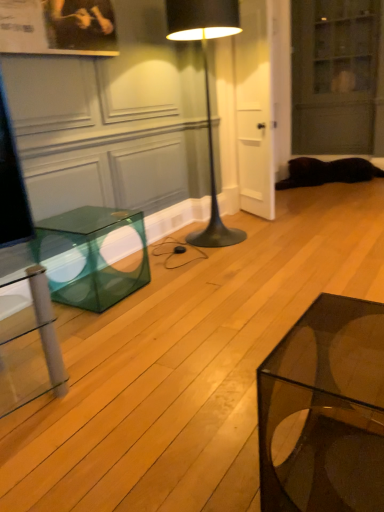
Question: Considering the relative sizes of black metal floor lamp at center and transparent glass cabinet at upper right in the image provided, is black metal floor lamp at center taller than transparent glass cabinet at upper right?

Choices:
 (A) yes
 (B) no

Answer: (B)

Question: Is black metal floor lamp at center positioned with its back to transparent glass cabinet at upper right?

Choices:
 (A) yes
 (B) no

Answer: (B)

Question: Is the position of black metal floor lamp at center more distant than that of transparent glass cabinet at upper right?

Choices:
 (A) no
 (B) yes

Answer: (A)

Question: Considering the relative sizes of black metal floor lamp at center and transparent glass cabinet at upper right in the image provided, is black metal floor lamp at center smaller than transparent glass cabinet at upper right?

Choices:
 (A) yes
 (B) no

Answer: (A)

Question: Considering the relative sizes of black metal floor lamp at center and transparent glass cabinet at upper right in the image provided, is black metal floor lamp at center shorter than transparent glass cabinet at upper right?

Choices:
 (A) no
 (B) yes

Answer: (B)

Question: Relative to black metal floor lamp at center, is black fur cat at lower right in front or behind?

Choices:
 (A) behind
 (B) front

Answer: (A)

Question: Visually, is black fur cat at lower right positioned to the left or to the right of black metal floor lamp at center?

Choices:
 (A) left
 (B) right

Answer: (B)

Question: Looking at their shapes, would you say black fur cat at lower right is wider or thinner than black metal floor lamp at center?

Choices:
 (A) thin
 (B) wide

Answer: (B)

Question: Based on their sizes in the image, would you say black fur cat at lower right is bigger or smaller than black metal floor lamp at center?

Choices:
 (A) small
 (B) big

Answer: (A)

Question: Is point (332, 178) closer or farther from the camera than point (294, 15)?

Choices:
 (A) farther
 (B) closer

Answer: (B)

Question: Is black fur cat at lower right situated inside transparent glass cabinet at upper right or outside?

Choices:
 (A) inside
 (B) outside

Answer: (B)

Question: Is black fur cat at lower right wider or thinner than transparent glass cabinet at upper right?

Choices:
 (A) wide
 (B) thin

Answer: (A)

Question: Is black fur cat at lower right taller or shorter than transparent glass cabinet at upper right?

Choices:
 (A) tall
 (B) short

Answer: (B)

Question: In the image, is transparent glass coffee table at lower right positioned in front of or behind transparent glass cabinet at upper right?

Choices:
 (A) front
 (B) behind

Answer: (A)

Question: Is transparent glass coffee table at lower right spatially inside transparent glass cabinet at upper right, or outside of it?

Choices:
 (A) inside
 (B) outside

Answer: (B)